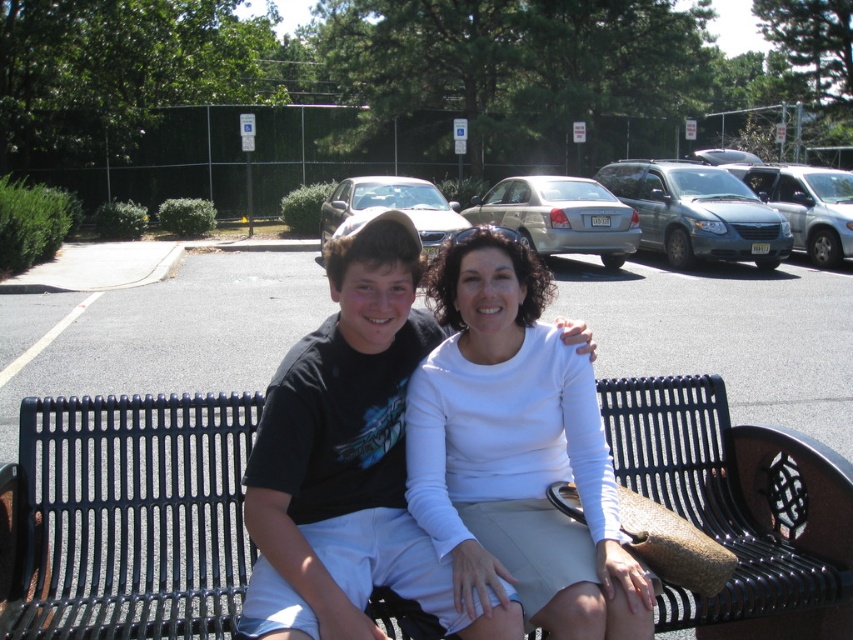
You are a photographer setting up a tripod to take a group photo of the people sitting on the black metal bench at center and wearing the white matte shirt at center. The tripod has a maximum height adjustment of 1.5 meters. Based on the scene, will the tripod be able to reach a height sufficient to capture both subjects comfortably?

The black metal bench at center has a lesser height compared to the white matte shirt at center, so the tripod needs to be adjusted to a height that accommodates the tallest subject. Since the white matte shirt at center is taller than the bench, the tripod should be set to its maximum height of 1.5 meters to ensure both subjects are captured comfortably.

You are standing at the point with coordinates point (131, 515). According to the scene, what object are you standing on?

The point (131, 515) indicates the black metal bench at center, so you are standing on the black metal bench at center.